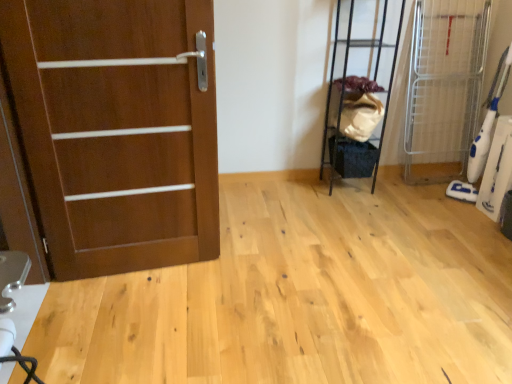
Question: Is black metal shelf at upper right, arranged as the 1th elevator when viewed from the left, turned away from white plastic vacuum cleaner at right, which is counted as the first elevator, starting from the right?

Choices:
 (A) yes
 (B) no

Answer: (B)

Question: Does black metal shelf at upper right, arranged as the 1th elevator when viewed from the left, have a lesser width compared to white plastic vacuum cleaner at right, which is counted as the first elevator, starting from the right?

Choices:
 (A) no
 (B) yes

Answer: (B)

Question: Does black metal shelf at upper right, arranged as the 1th elevator when viewed from the left, have a smaller size compared to white plastic vacuum cleaner at right, which ranks as the 2th elevator in left-to-right order?

Choices:
 (A) no
 (B) yes

Answer: (A)

Question: Does black metal shelf at upper right, which ranks as the second elevator in right-to-left order, have a lesser height compared to white plastic vacuum cleaner at right, which is counted as the first elevator, starting from the right?

Choices:
 (A) no
 (B) yes

Answer: (A)

Question: Is black metal shelf at upper right, which ranks as the second elevator in right-to-left order, in contact with white plastic vacuum cleaner at right, which is counted as the first elevator, starting from the right?

Choices:
 (A) yes
 (B) no

Answer: (B)

Question: Is there a large distance between black metal shelf at upper right, which ranks as the second elevator in right-to-left order, and white plastic vacuum cleaner at right, which is counted as the first elevator, starting from the right?

Choices:
 (A) yes
 (B) no

Answer: (B)

Question: From a real-world perspective, is white plastic vacuum cleaner at right, which ranks as the 2th elevator in left-to-right order, under black metal shelf at upper right, arranged as the 1th elevator when viewed from the left?

Choices:
 (A) yes
 (B) no

Answer: (A)

Question: Is white plastic vacuum cleaner at right, which ranks as the 2th elevator in left-to-right order, positioned before black metal shelf at upper right, arranged as the 1th elevator when viewed from the left?

Choices:
 (A) no
 (B) yes

Answer: (B)

Question: Is white plastic vacuum cleaner at right, which ranks as the 2th elevator in left-to-right order, smaller than black metal shelf at upper right, arranged as the 1th elevator when viewed from the left?

Choices:
 (A) no
 (B) yes

Answer: (B)

Question: From the image's perspective, is white plastic vacuum cleaner at right, which is counted as the first elevator, starting from the right, over black metal shelf at upper right, which ranks as the second elevator in right-to-left order?

Choices:
 (A) yes
 (B) no

Answer: (B)

Question: Is the surface of white plastic vacuum cleaner at right, which ranks as the 2th elevator in left-to-right order, in direct contact with black metal shelf at upper right, which ranks as the second elevator in right-to-left order?

Choices:
 (A) yes
 (B) no

Answer: (B)

Question: Considering the relative positions of white plastic vacuum cleaner at right, which is counted as the first elevator, starting from the right, and black metal shelf at upper right, arranged as the 1th elevator when viewed from the left, in the image provided, is white plastic vacuum cleaner at right, which is counted as the first elevator, starting from the right, to the left of black metal shelf at upper right, arranged as the 1th elevator when viewed from the left, from the viewer's perspective?

Choices:
 (A) no
 (B) yes

Answer: (A)

Question: Considering the relative sizes of matte wood door at left and black metal shelf at upper right, which ranks as the second elevator in right-to-left order, in the image provided, is matte wood door at left shorter than black metal shelf at upper right, which ranks as the second elevator in right-to-left order,?

Choices:
 (A) no
 (B) yes

Answer: (A)